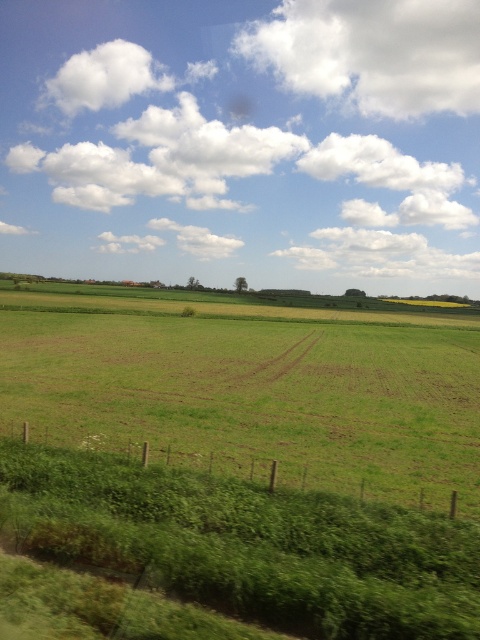
Question: Which of the following is the closest to the observer?

Choices:
 (A) green grassy field at center
 (B) green leafy grass at lower left

Answer: (B)

Question: Can you confirm if green grassy field at center is positioned above green leafy grass at lower left?

Choices:
 (A) no
 (B) yes

Answer: (B)

Question: Can you confirm if green grassy field at center is bigger than green leafy grass at lower left?

Choices:
 (A) no
 (B) yes

Answer: (B)

Question: Is green grassy field at center below green leafy grass at lower left?

Choices:
 (A) yes
 (B) no

Answer: (B)